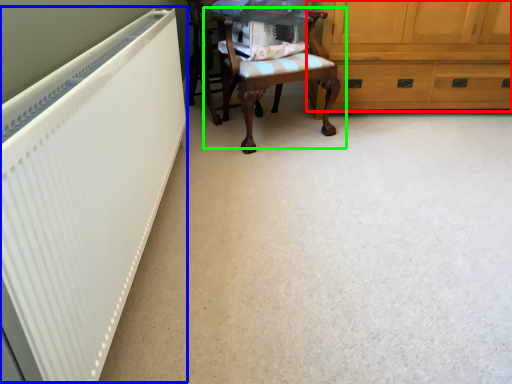
Question: Estimate the real-world distances between objects in this image. Which object is farther from cabinetry (highlighted by a red box), radiator (highlighted by a blue box) or chair (highlighted by a green box)?

Choices:
 (A) radiator
 (B) chair

Answer: (A)